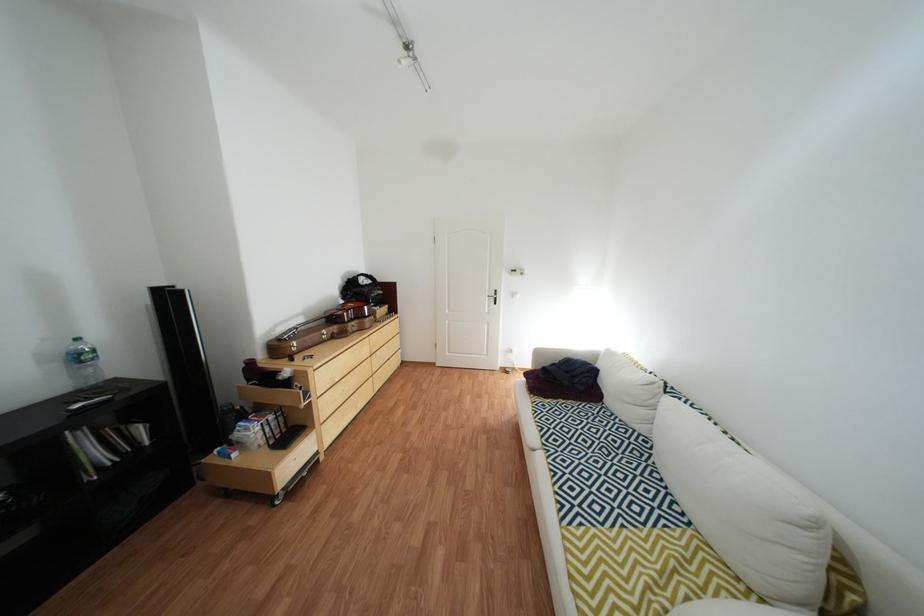
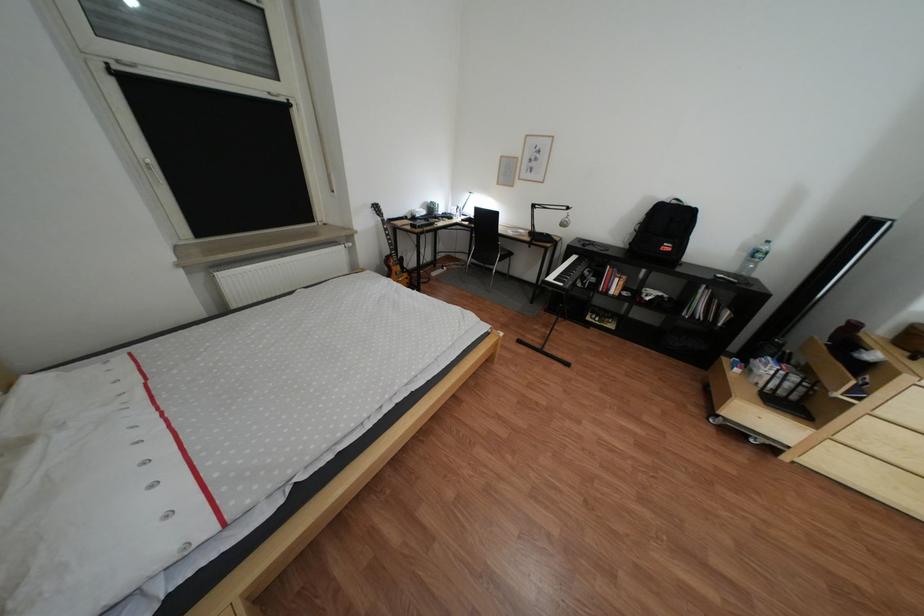
The first image is from the beginning of the video and the second image is from the end. How did the camera likely rotate when shooting the video?

The rotation direction of the camera is left-down.